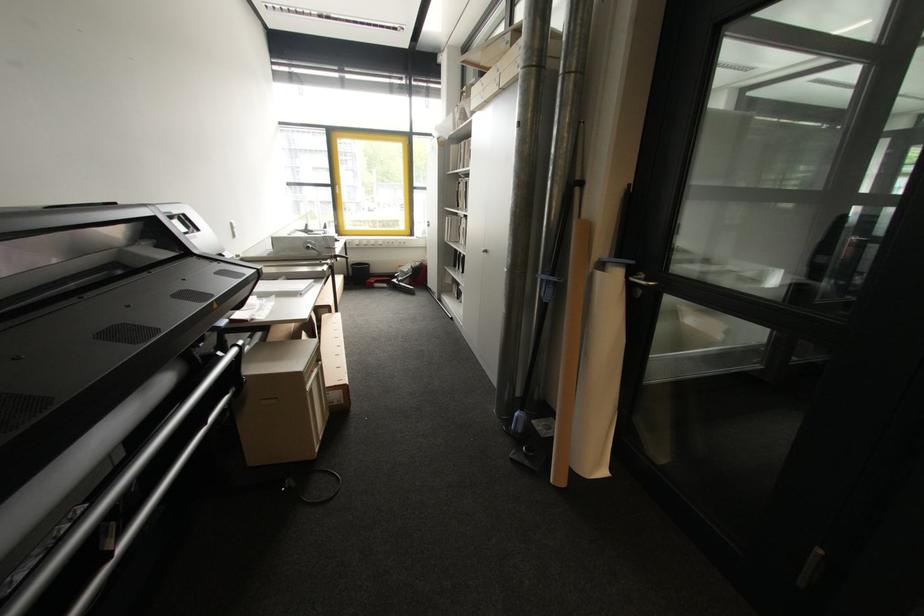
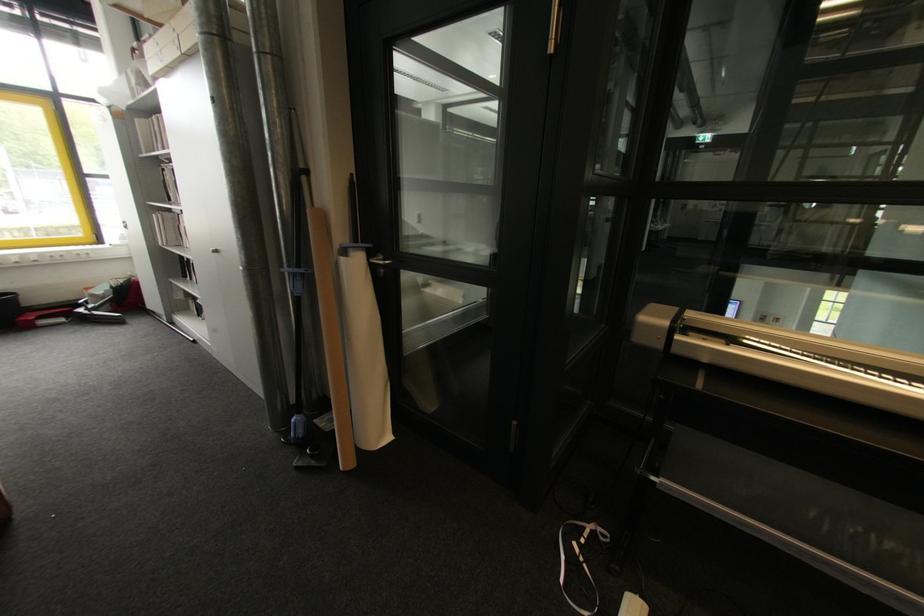
The point at (609,472) is marked in the first image. Where is the corresponding point in the second image?

(393, 438)